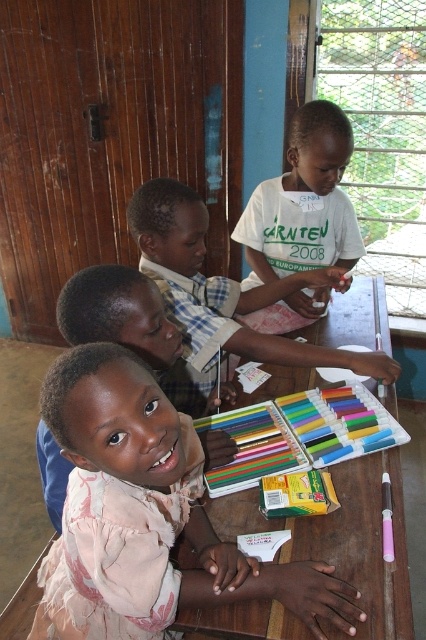
You are standing in the classroom and want to reach the point marked at coordinates point (293, 563). If your arm can extend 3 feet, can you reach it without moving?

The distance between you and point (293, 563) is 3.47 feet, which is beyond your 3 feet arm reach. You need to move closer.

You are a photographer setting up in a classroom. You notice the pink fabric child at center and the matte pink dress at center. Which object is closer to the camera?

The pink fabric child at center is positioned under the matte pink dress at center, meaning the matte pink dress at center is closer to the camera.

You are standing in front of the classroom door and want to take a photo of the point at coordinates (x=127, y=531). The camera you are using has a maximum focus range of 80 centimeters. Will the camera be able to focus on the point?

The point at coordinates (x=127, y=531) is 83.61 centimeters away from the camera. Since the camera can only focus up to 80 centimeters, it will not be able to focus on the point.